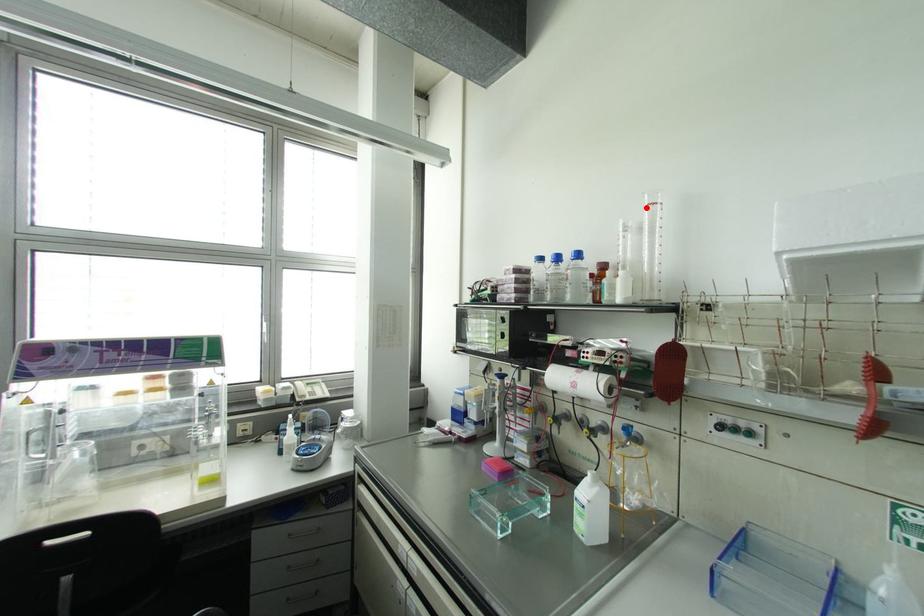
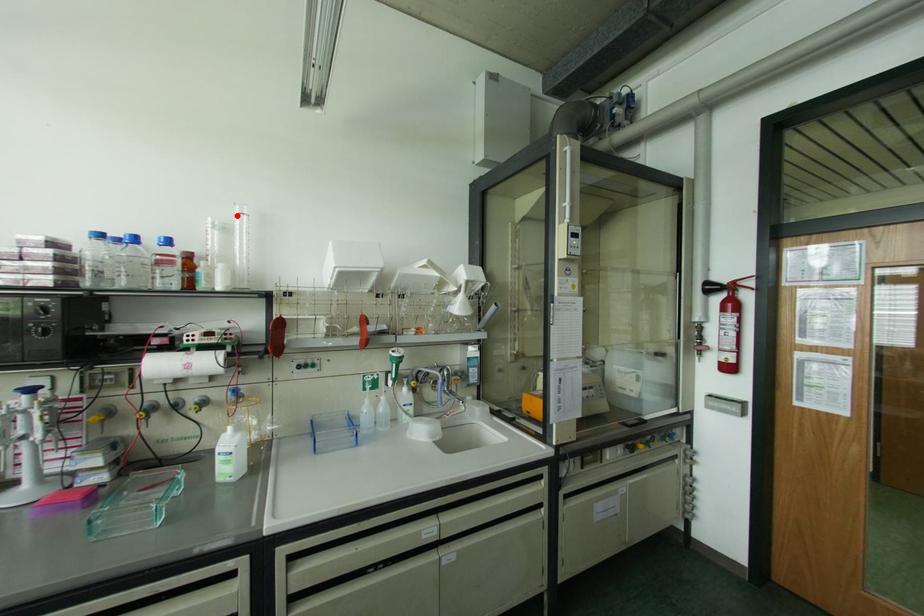
I am providing you with two images of the same scene from different viewpoints. A red point is marked on the first image and another point is marked on the second image. Is the marked point in image1 the same physical position as the marked point in image2?

Yes